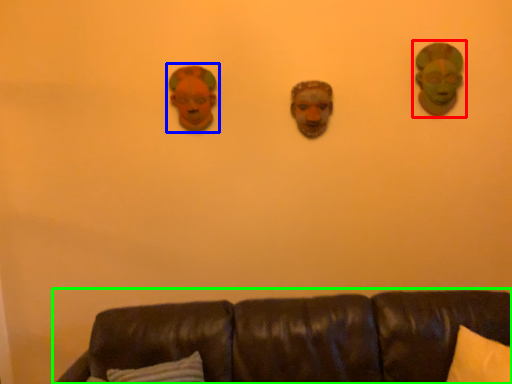
Question: Considering the real-world distances, which object is closest to person (highlighted by a red box)? decor (highlighted by a blue box) or studio couch (highlighted by a green box).

Choices:
 (A) decor
 (B) studio couch

Answer: (A)